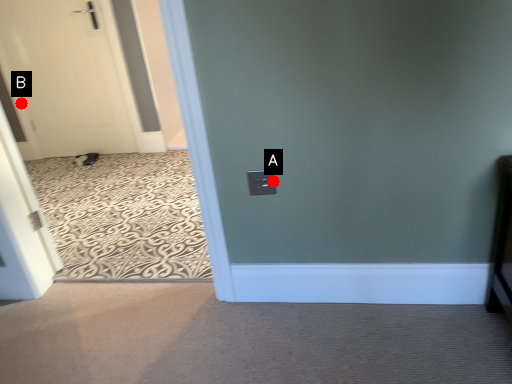
Question: Two points are circled on the image, labeled by A and B beside each circle. Which point appears closest to the camera in this image?

Choices:
 (A) A is closer
 (B) B is closer

Answer: (A)